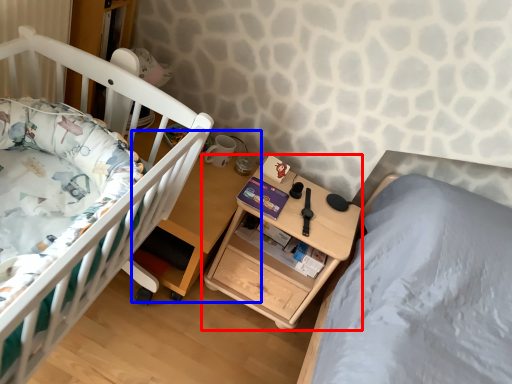
Question: Which of the following is the farthest to the observer, nightstand (highlighted by a red box) or table (highlighted by a blue box)?

Choices:
 (A) nightstand
 (B) table

Answer: (A)